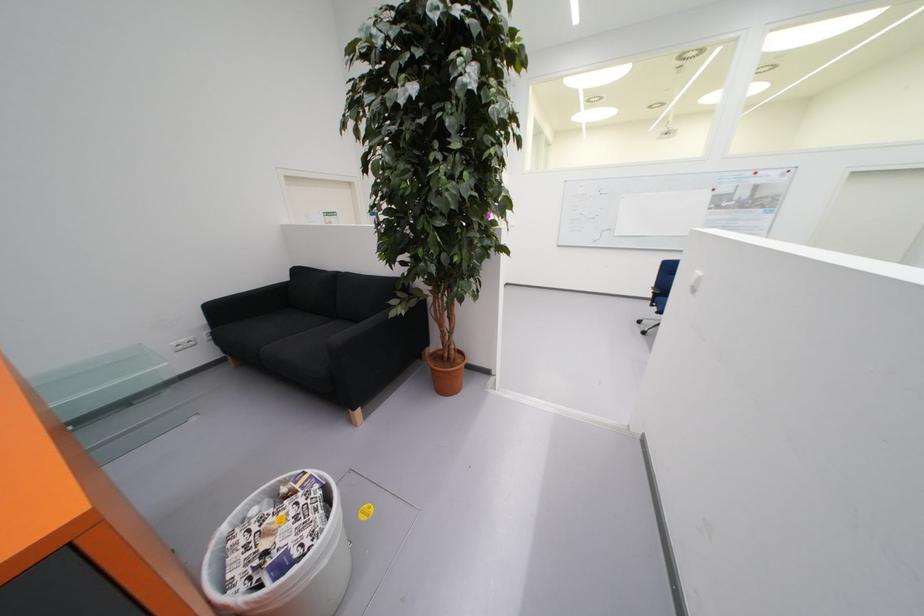
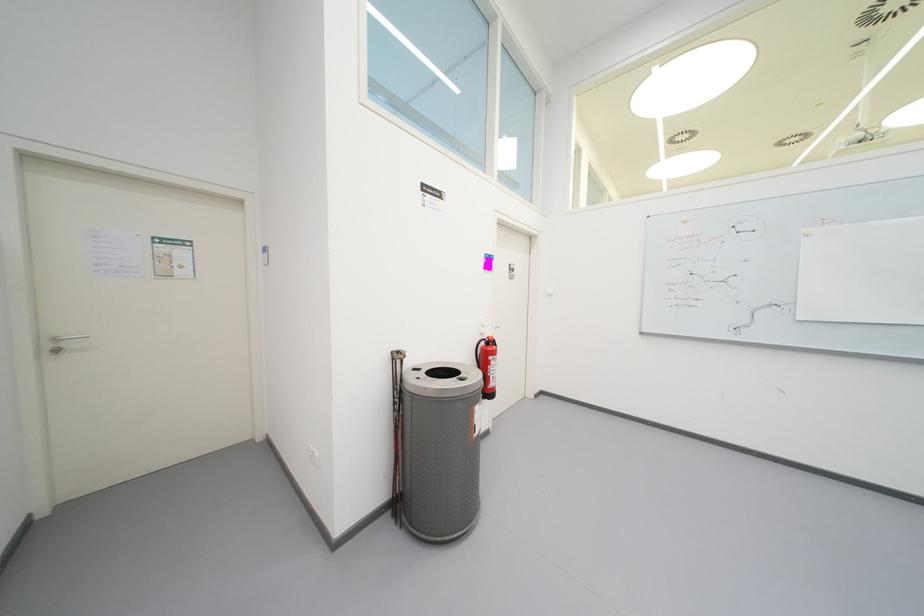
What movement of the cameraman would produce the second image?

The cameraman walked toward right, forward.